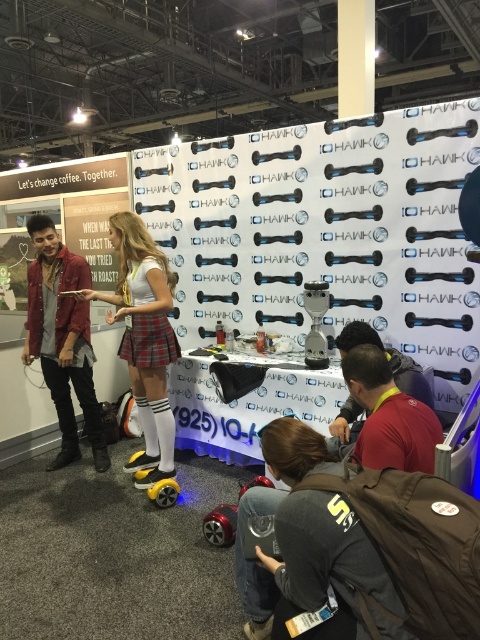
Between reddish-brown leather jacket at lower right and dark brown leather jacket at lower right, which one appears on the left side from the viewer's perspective?

reddish-brown leather jacket at lower right

Can you confirm if reddish-brown leather jacket at lower right is wider than dark brown leather jacket at lower right?

Correct, the width of reddish-brown leather jacket at lower right exceeds that of dark brown leather jacket at lower right.

Who is more forward, (367, 353) or (408, 400)?

Point (408, 400) is in front.

In order to click on reddish-brown leather jacket at lower right in this screenshot , I will do `click(308, 516)`.

Who is shorter, reddish-brown leather jacket at lower right or matte yellow hoverboard at center?

reddish-brown leather jacket at lower right

Can you confirm if reddish-brown leather jacket at lower right is wider than matte yellow hoverboard at center?

Correct, the width of reddish-brown leather jacket at lower right exceeds that of matte yellow hoverboard at center.

Identify the location of reddish-brown leather jacket at lower right. (308, 516).

Which of these two, matte yellow hoverboard at center or dark brown leather jacket at lower right, stands shorter?

dark brown leather jacket at lower right

What are the coordinates of `matte yellow hoverboard at center` in the screenshot? It's located at (144, 337).